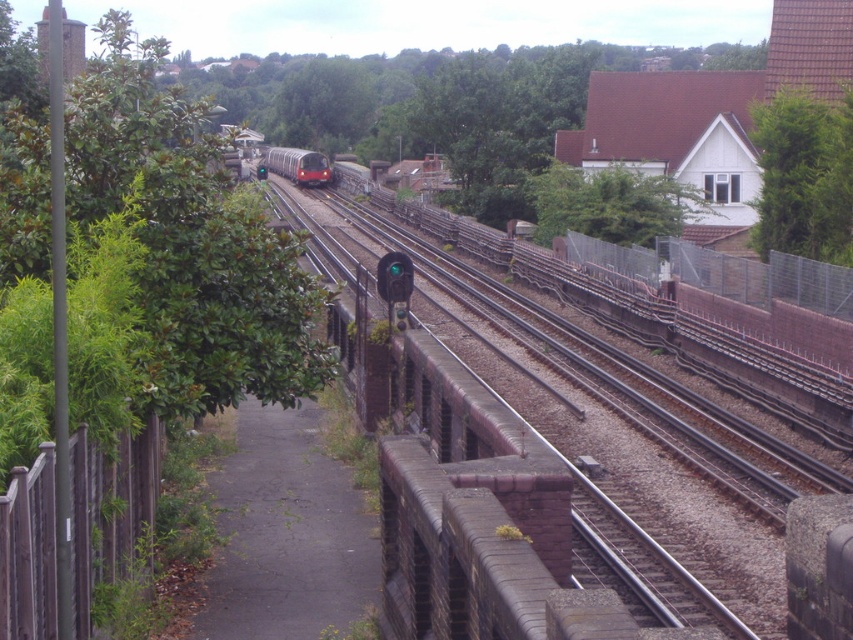
Is green leafy tree at upper right in front of green leafy tree at upper center?

That is True.

Who is taller, green leafy tree at upper right or green leafy tree at upper center?

Standing taller between the two is green leafy tree at upper center.

What do you see at coordinates (804, 177) in the screenshot? Image resolution: width=853 pixels, height=640 pixels. I see `green leafy tree at upper right` at bounding box center [804, 177].

Where is `green leafy tree at upper right`? The height and width of the screenshot is (640, 853). green leafy tree at upper right is located at coordinates (804, 177).

Who is more distant from viewer, (86, 572) or (801, 124)?

The point (801, 124) is more distant.

Locate an element on the screen. This screenshot has width=853, height=640. brown wooden fence at left is located at coordinates (109, 508).

Does green leafy tree at upper center appear over red metallic train at center?

No, green leafy tree at upper center is not above red metallic train at center.

Does green leafy tree at upper center have a greater width compared to red metallic train at center?

Incorrect, green leafy tree at upper center's width does not surpass red metallic train at center's.

In the scene shown: Who is more forward, (637, 172) or (294, 147)?

Positioned in front is point (637, 172).

The width and height of the screenshot is (853, 640). What are the coordinates of `green leafy tree at upper center` in the screenshot? It's located at (610, 204).